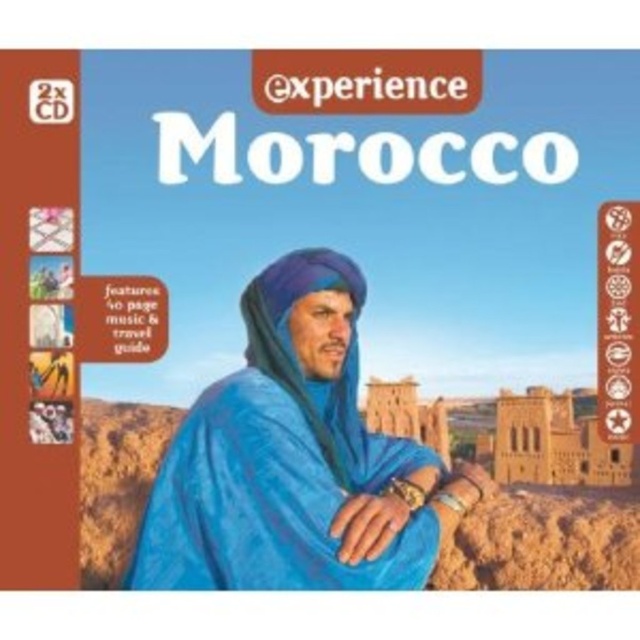
Question: Considering the relative positions of blue velvet robe at center and blue fabric headscarf at center in the image provided, where is blue velvet robe at center located with respect to blue fabric headscarf at center?

Choices:
 (A) below
 (B) above

Answer: (A)

Question: Can you confirm if blue velvet robe at center is wider than blue fabric headscarf at center?

Choices:
 (A) no
 (B) yes

Answer: (B)

Question: Can you confirm if blue velvet robe at center is smaller than blue fabric headscarf at center?

Choices:
 (A) no
 (B) yes

Answer: (A)

Question: Which object is closer to the camera taking this photo?

Choices:
 (A) blue fabric headscarf at center
 (B) blue velvet robe at center

Answer: (B)